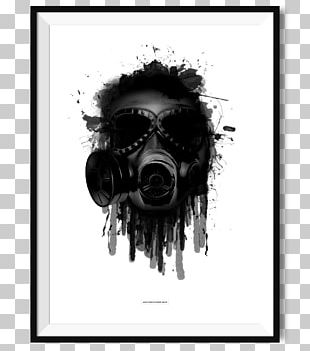
The height and width of the screenshot is (351, 310). Identify the location of white mat around image. click(45, 243), click(90, 328).